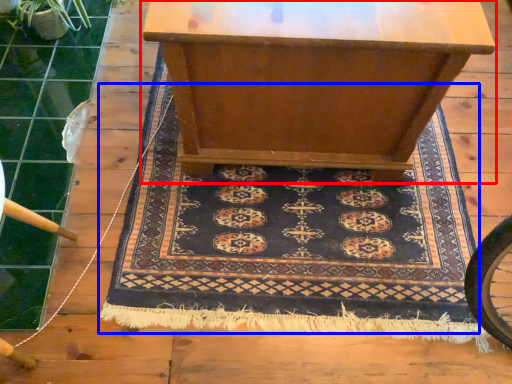
Question: Which of the following is the closest to the observer, table (highlighted by a red box) or mat (highlighted by a blue box)?

Choices:
 (A) table
 (B) mat

Answer: (A)